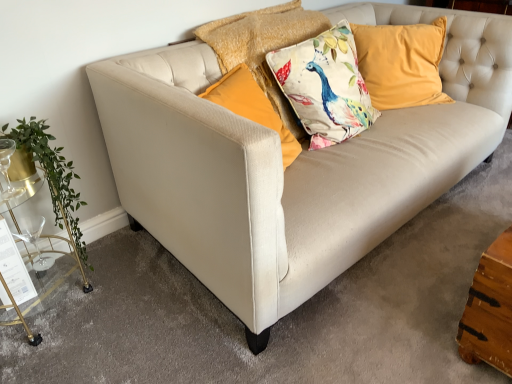
Question: From the image's perspective, would you say gold metallic bar cart at left is positioned over clear glass wine glass at lower left?

Choices:
 (A) no
 (B) yes

Answer: (B)

Question: Can you confirm if gold metallic bar cart at left is wider than clear glass wine glass at lower left?

Choices:
 (A) no
 (B) yes

Answer: (B)

Question: Is gold metallic bar cart at left positioned in front of clear glass wine glass at lower left?

Choices:
 (A) yes
 (B) no

Answer: (A)

Question: Does gold metallic bar cart at left have a smaller size compared to clear glass wine glass at lower left?

Choices:
 (A) yes
 (B) no

Answer: (B)

Question: Is clear glass wine glass at lower left surrounded by gold metallic bar cart at left?

Choices:
 (A) no
 (B) yes

Answer: (B)

Question: Does gold metallic bar cart at left have a lesser height compared to clear glass wine glass at lower left?

Choices:
 (A) yes
 (B) no

Answer: (B)

Question: Can you confirm if green leafy plant at left is bigger than floral fabric cushion at center, arranged as the second pillow when viewed from the right?

Choices:
 (A) no
 (B) yes

Answer: (A)

Question: Is green leafy plant at left further to the viewer compared to floral fabric cushion at center, acting as the 1th pillow starting from the left?

Choices:
 (A) no
 (B) yes

Answer: (A)

Question: From the image's perspective, is green leafy plant at left over floral fabric cushion at center, acting as the 1th pillow starting from the left?

Choices:
 (A) yes
 (B) no

Answer: (B)

Question: Can you confirm if green leafy plant at left is shorter than floral fabric cushion at center, arranged as the second pillow when viewed from the right?

Choices:
 (A) no
 (B) yes

Answer: (A)

Question: From a real-world perspective, is green leafy plant at left below floral fabric cushion at center, acting as the 1th pillow starting from the left?

Choices:
 (A) no
 (B) yes

Answer: (B)

Question: Does green leafy plant at left come in front of floral fabric cushion at center, acting as the 1th pillow starting from the left?

Choices:
 (A) no
 (B) yes

Answer: (B)

Question: From a real-world perspective, is green leafy plant at left located higher than clear glass wine glass at lower left?

Choices:
 (A) no
 (B) yes

Answer: (B)